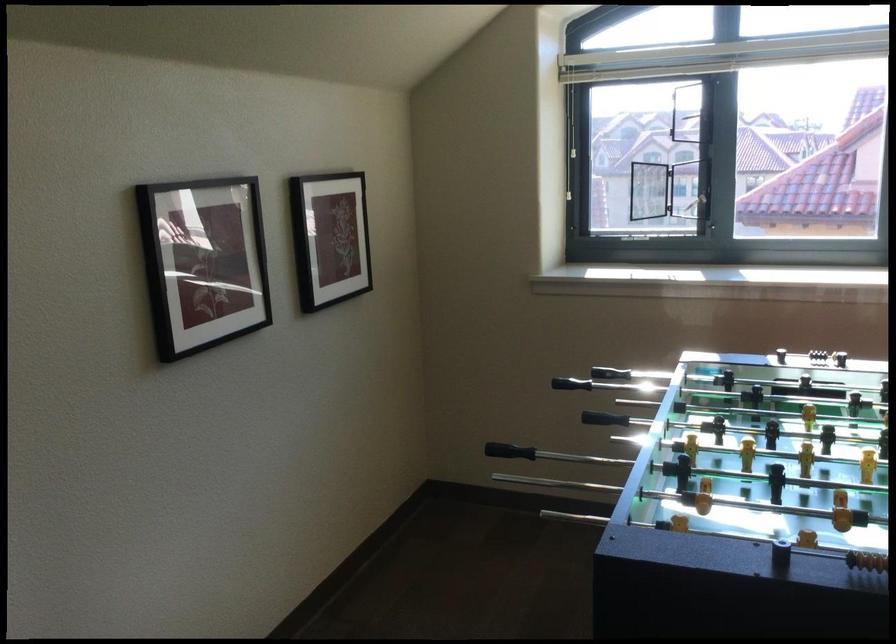
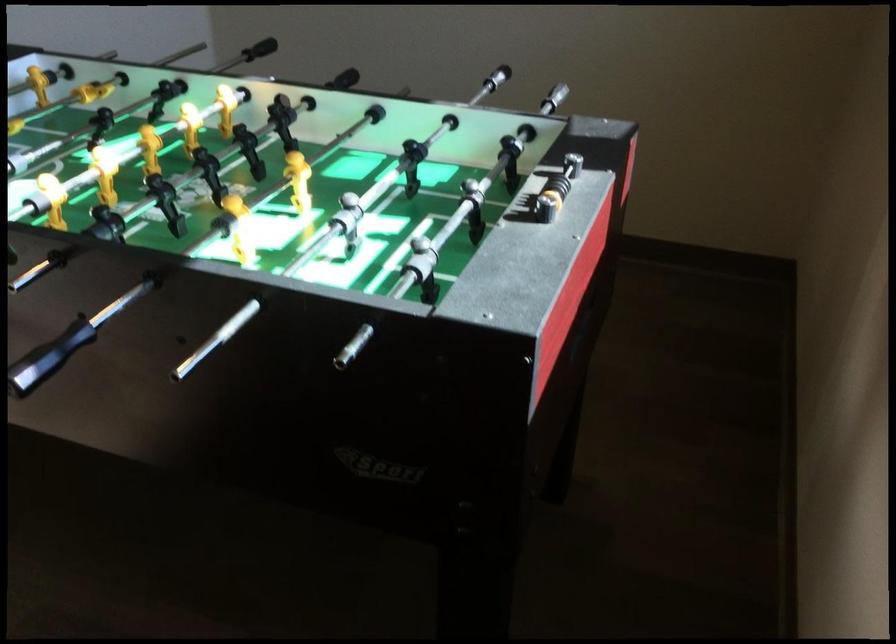
Where in the second image is the point corresponding to [330,444] from the first image?

(554, 98)